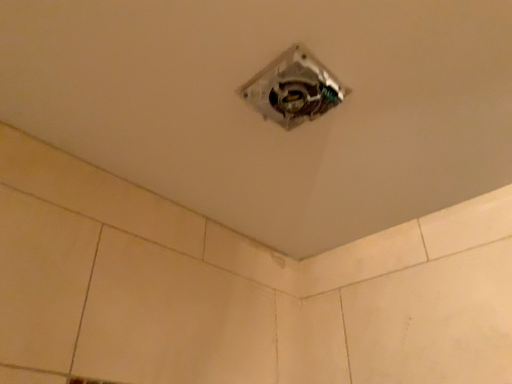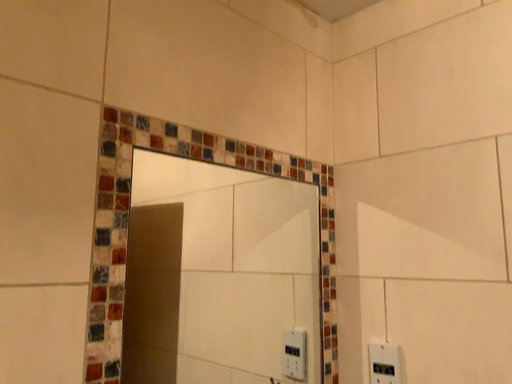
Question: How did the camera likely rotate when shooting the video?

Choices:
 (A) rotated upward
 (B) rotated downward

Answer: (B)